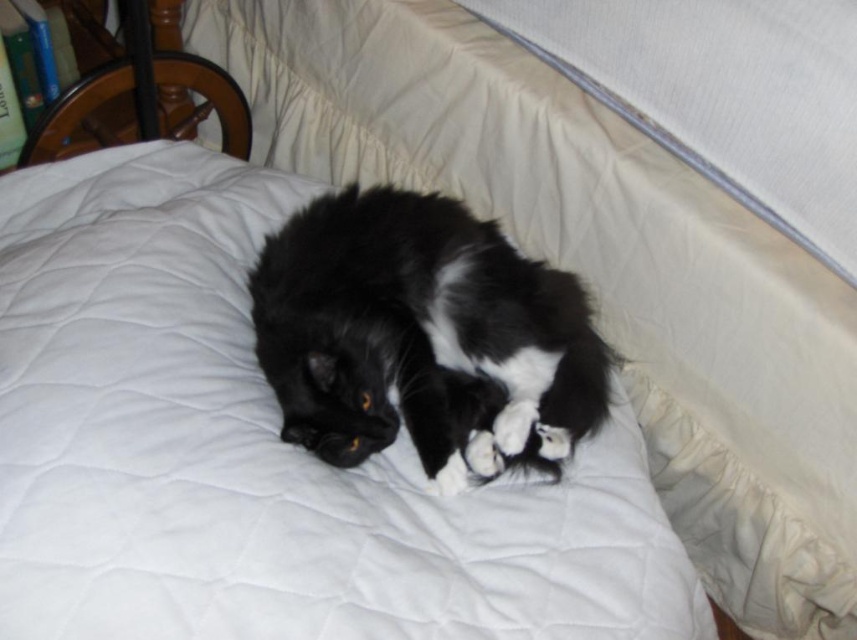
Question: Among these objects, which one is nearest to the camera?

Choices:
 (A) black soft fur cat at center
 (B) white quilt at center

Answer: (B)

Question: Can you confirm if white quilt at center is positioned to the left of black soft fur cat at center?

Choices:
 (A) no
 (B) yes

Answer: (B)

Question: Does white quilt at center appear over black soft fur cat at center?

Choices:
 (A) no
 (B) yes

Answer: (A)

Question: Which point is farther to the camera?

Choices:
 (A) black soft fur cat at center
 (B) white quilt at center

Answer: (A)

Question: Observing the image, what is the correct spatial positioning of white quilt at center in reference to black soft fur cat at center?

Choices:
 (A) right
 (B) left

Answer: (B)

Question: Which object is farther from the camera taking this photo?

Choices:
 (A) black soft fur cat at center
 (B) white quilt at center

Answer: (A)